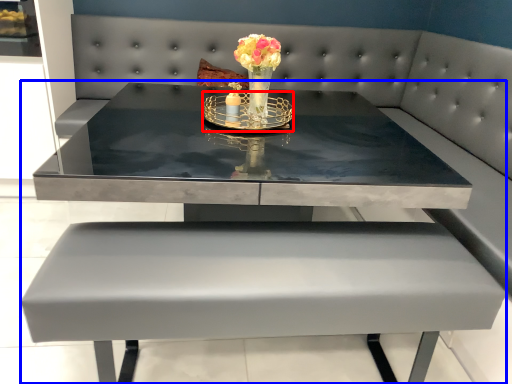
Question: Which object appears closest to the camera in this image, candle holder (highlighted by a red box) or table (highlighted by a blue box)?

Choices:
 (A) candle holder
 (B) table

Answer: (B)